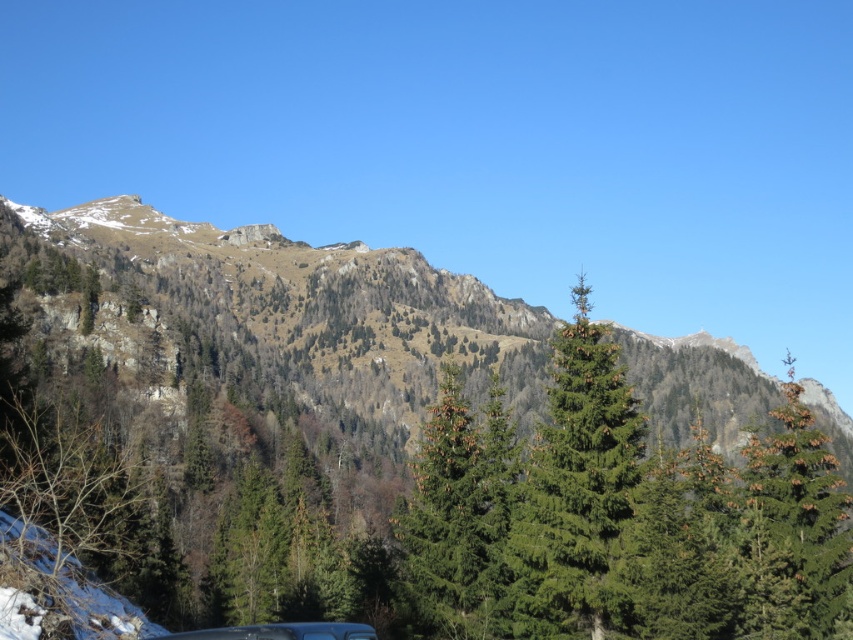
Question: Which of the following is the farthest from the observer?

Choices:
 (A) metallic silver car at lower center
 (B) green textured pine tree at center

Answer: (B)

Question: Which of the following is the closest to the observer?

Choices:
 (A) green textured pine tree at center
 (B) brown/dry grassy mountain at upper center
 (C) metallic silver car at lower center

Answer: (C)

Question: Does brown/dry grassy mountain at upper center have a smaller size compared to green textured pine tree at center?

Choices:
 (A) yes
 (B) no

Answer: (B)

Question: Is green textured pine tree at center below metallic silver car at lower center?

Choices:
 (A) no
 (B) yes

Answer: (A)

Question: Among these objects, which one is nearest to the camera?

Choices:
 (A) green textured pine tree at center
 (B) brown/dry grassy mountain at upper center

Answer: (A)

Question: Does brown/dry grassy mountain at upper center have a lesser width compared to metallic silver car at lower center?

Choices:
 (A) yes
 (B) no

Answer: (B)